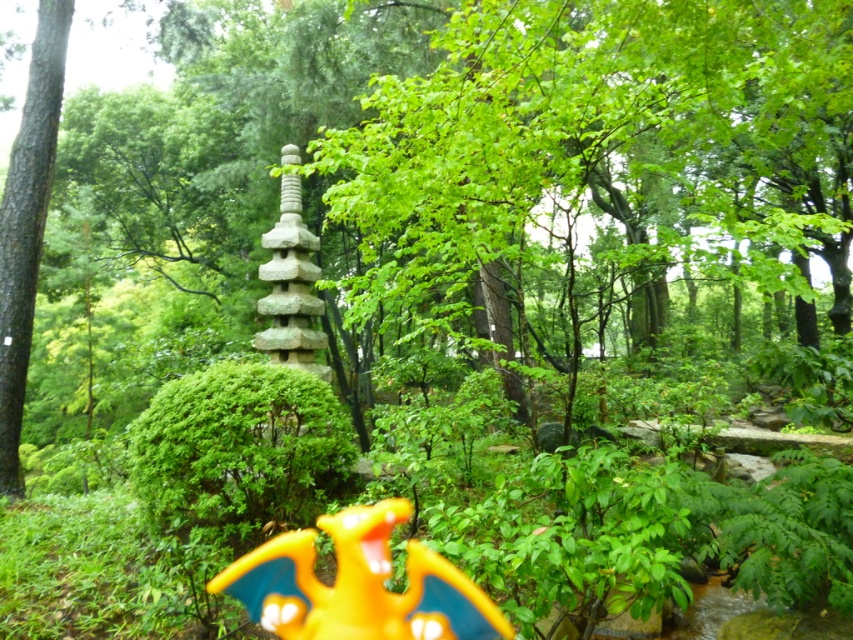
Does yellow matte toy dragon at lower center appear on the right side of green rough bark tree at left?

Yes, yellow matte toy dragon at lower center is to the right of green rough bark tree at left.

Can you confirm if yellow matte toy dragon at lower center is taller than green rough bark tree at left?

Incorrect, yellow matte toy dragon at lower center's height is not larger of green rough bark tree at left's.

Between point (419, 548) and point (25, 99), which one is positioned behind?

The point (25, 99) is behind.

Identify the location of yellow matte toy dragon at lower center. (358, 584).